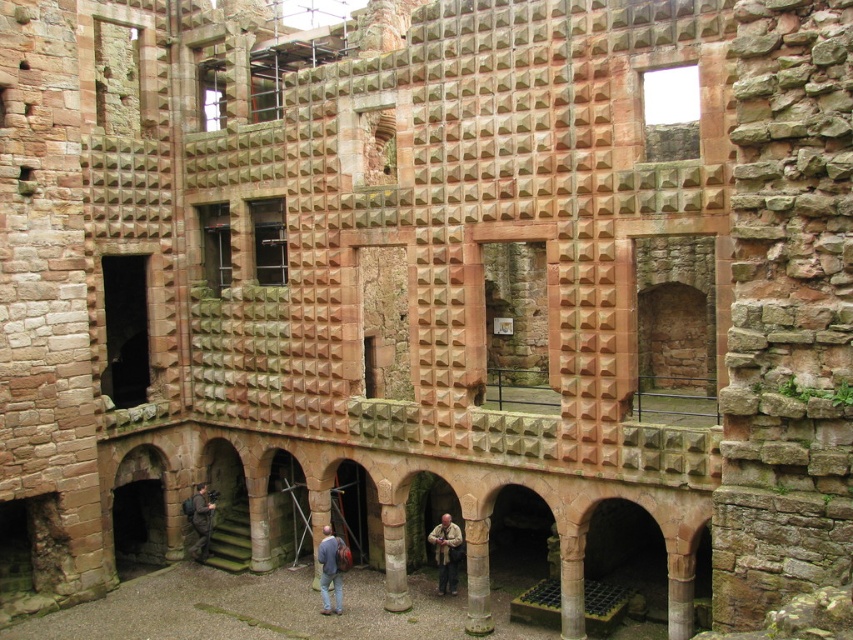
Which is below, brown textured jacket at lower center or blue denim jacket at lower center?

blue denim jacket at lower center is lower down.

Does brown textured jacket at lower center have a lesser height compared to blue denim jacket at lower center?

Indeed, brown textured jacket at lower center has a lesser height compared to blue denim jacket at lower center.

Is point (457, 557) in front of point (337, 556)?

No, it is not.

At what (x,y) coordinates should I click in order to perform the action: click on brown textured jacket at lower center. Please return your answer as a coordinate pair (x, y). Image resolution: width=853 pixels, height=640 pixels. Looking at the image, I should click on (445, 554).

Does blue denim jacket at lower center have a lesser width compared to dark gray fabric jacket at lower center?

Indeed, blue denim jacket at lower center has a lesser width compared to dark gray fabric jacket at lower center.

Who is taller, blue denim jacket at lower center or dark gray fabric jacket at lower center?

With more height is blue denim jacket at lower center.

What are the coordinates of `blue denim jacket at lower center` in the screenshot? It's located at (329, 570).

Between smooth stone column at center and dark gray fabric jacket at lower center, which one has less height?

smooth stone column at center

Can you confirm if smooth stone column at center is bigger than dark gray fabric jacket at lower center?

Incorrect, smooth stone column at center is not larger than dark gray fabric jacket at lower center.

I want to click on smooth stone column at center, so click(393, 557).